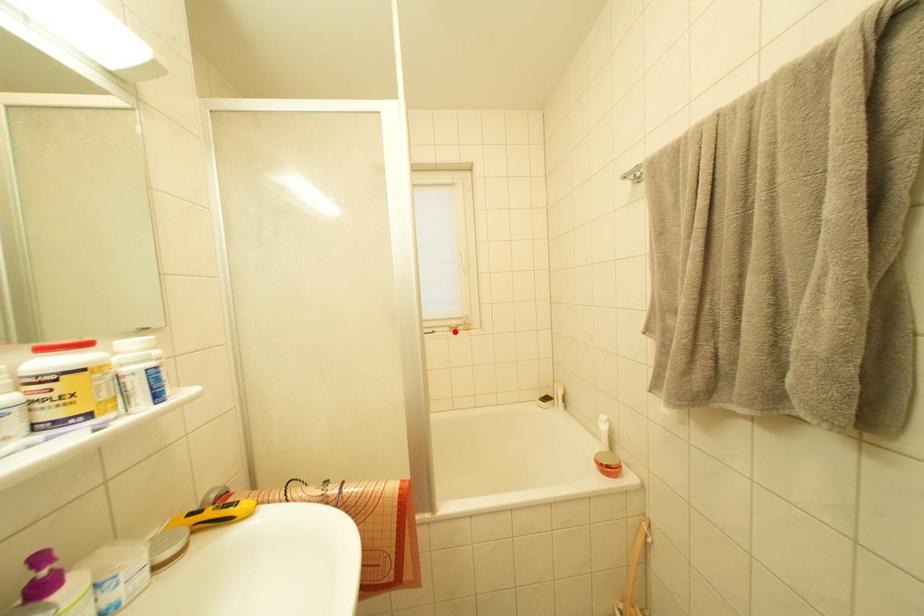
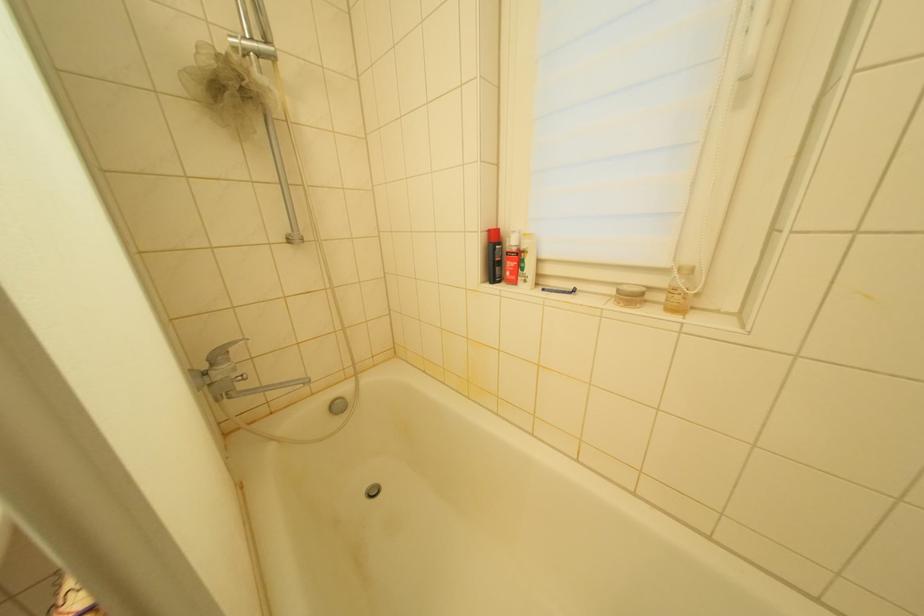
Locate, in the second image, the point that corresponds to the highlighted location in the first image.

(623, 294)